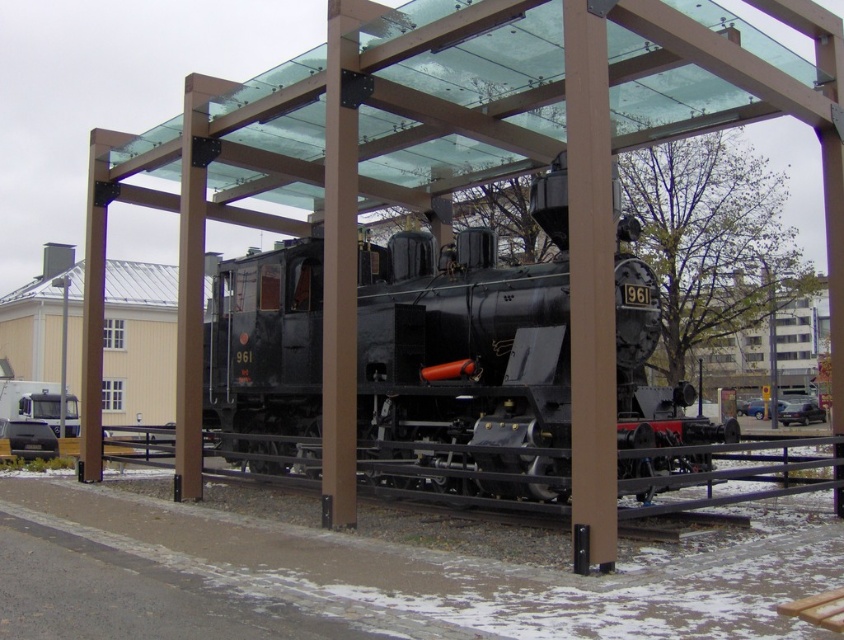
Question: Which point is closer to the camera?

Choices:
 (A) black metal rail at center
 (B) matte black locomotive at center

Answer: (A)

Question: Is matte black locomotive at center smaller than black metal rail at center?

Choices:
 (A) yes
 (B) no

Answer: (A)

Question: In this image, where is matte black locomotive at center located relative to black metal rail at center?

Choices:
 (A) below
 (B) above

Answer: (B)

Question: In this image, where is matte black locomotive at center located relative to black metal rail at center?

Choices:
 (A) right
 (B) left

Answer: (B)